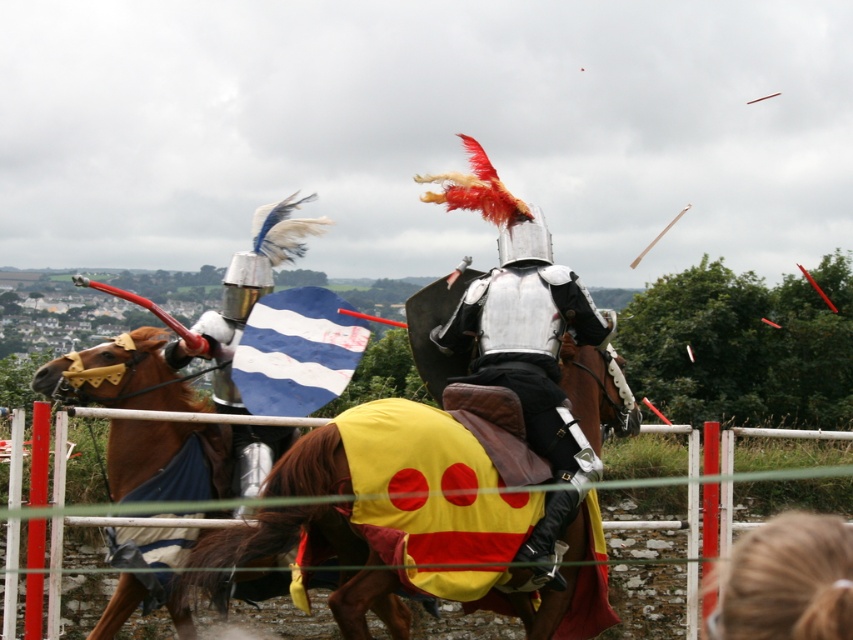
You are a knight preparing to enter the arena. You see the yellow fabric horse at center and the white metal fence at lower center. Which object is narrower?

The yellow fabric horse at center is narrower than the white metal fence at lower center.

You are a knight preparing to enter the jousting arena. You see the shiny silver armor at center and the blonde hair at lower right. Which object is positioned higher up in the image?

The shiny silver armor at center is taller than blonde hair at lower right, so the shiny silver armor at center is positioned higher up in the image.

You are a spectator at the jousting event. You see the brown glossy horse at left and the blonde hair at lower right. Which one is higher in the image?

The brown glossy horse at left is above blonde hair at lower right, so the brown glossy horse at left is higher in the image.